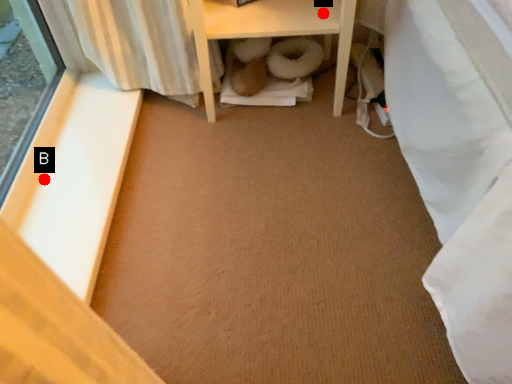
Question: Two points are circled on the image, labeled by A and B beside each circle. Among these points, which one is farthest from the camera?

Choices:
 (A) A is further
 (B) B is further

Answer: (A)